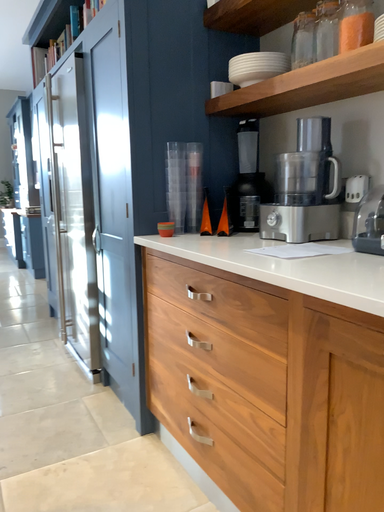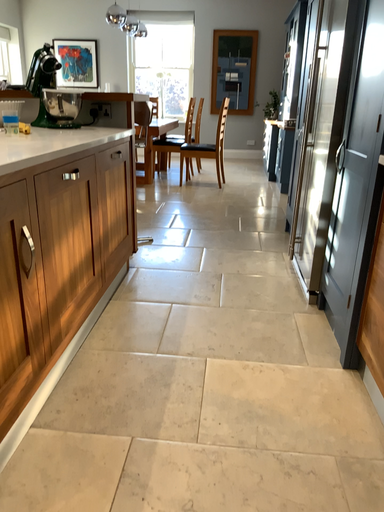
Question: Which way did the camera rotate in the video?

Choices:
 (A) rotated upward
 (B) rotated downward

Answer: (B)